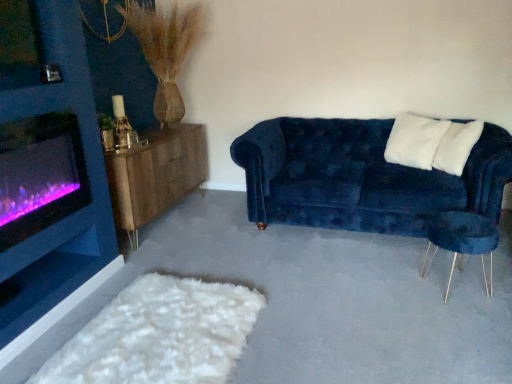
Where is `free spot in front of velvet blue couch at right`? This screenshot has width=512, height=384. free spot in front of velvet blue couch at right is located at coordinates (374, 292).